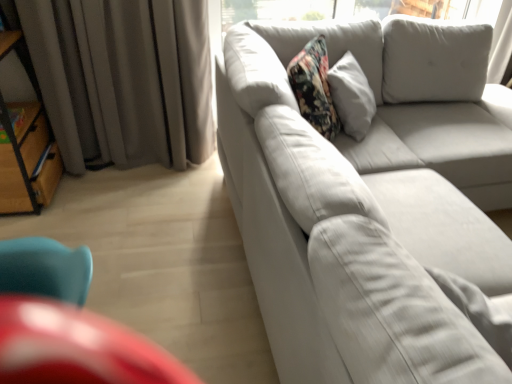
Question: Is woodenmaterial/texturebookshelf at left taller than gray fabric curtain at left?

Choices:
 (A) yes
 (B) no

Answer: (A)

Question: Can you confirm if woodenmaterial/texturebookshelf at left is shorter than gray fabric curtain at left?

Choices:
 (A) no
 (B) yes

Answer: (A)

Question: Considering the relative positions of woodenmaterial/texturebookshelf at left and gray fabric curtain at left in the image provided, is woodenmaterial/texturebookshelf at left to the right of gray fabric curtain at left from the viewer's perspective?

Choices:
 (A) no
 (B) yes

Answer: (A)

Question: From the image's perspective, is woodenmaterial/texturebookshelf at left located above gray fabric curtain at left?

Choices:
 (A) no
 (B) yes

Answer: (A)

Question: From a real-world perspective, is woodenmaterial/texturebookshelf at left physically above gray fabric curtain at left?

Choices:
 (A) yes
 (B) no

Answer: (B)

Question: Is woodenmaterial/texturebookshelf at left in contact with gray fabric curtain at left?

Choices:
 (A) no
 (B) yes

Answer: (A)

Question: Can you confirm if white fabric couch at right is wider than woodenmaterial/texturebookshelf at left?

Choices:
 (A) yes
 (B) no

Answer: (A)

Question: Does white fabric couch at right turn towards woodenmaterial/texturebookshelf at left?

Choices:
 (A) no
 (B) yes

Answer: (A)

Question: Can you confirm if white fabric couch at right is positioned to the right of woodenmaterial/texturebookshelf at left?

Choices:
 (A) no
 (B) yes

Answer: (B)

Question: Considering the relative sizes of white fabric couch at right and woodenmaterial/texturebookshelf at left in the image provided, is white fabric couch at right shorter than woodenmaterial/texturebookshelf at left?

Choices:
 (A) no
 (B) yes

Answer: (B)

Question: Is white fabric couch at right positioned in front of woodenmaterial/texturebookshelf at left?

Choices:
 (A) no
 (B) yes

Answer: (B)

Question: Is white fabric couch at right smaller than woodenmaterial/texturebookshelf at left?

Choices:
 (A) yes
 (B) no

Answer: (B)

Question: Considering the relative positions of gray fabric curtain at left and white fabric pillow at center in the image provided, is gray fabric curtain at left to the left of white fabric pillow at center from the viewer's perspective?

Choices:
 (A) yes
 (B) no

Answer: (A)